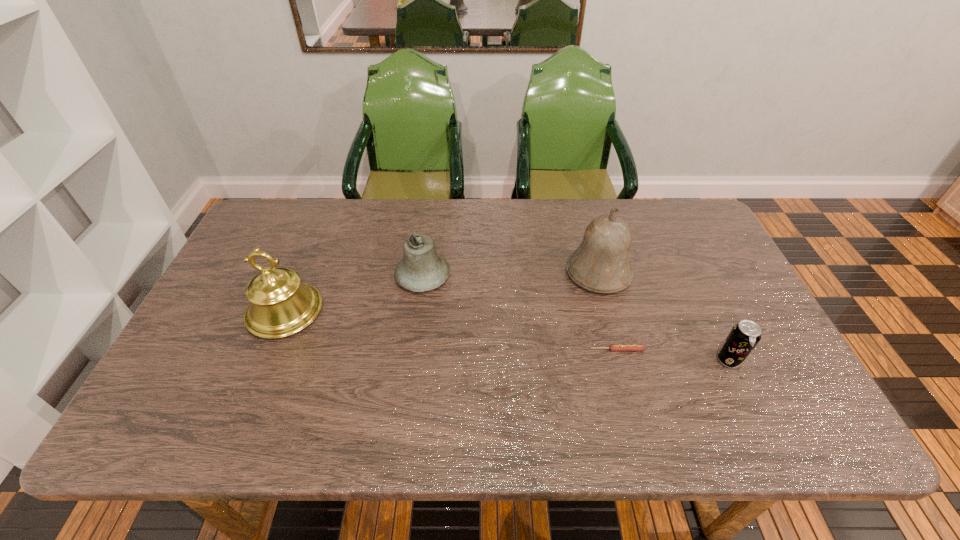
Image resolution: width=960 pixels, height=540 pixels. Identify the location of the rightmost bell. (601, 264).

This screenshot has width=960, height=540. Find the location of `the leftmost object`. the leftmost object is located at coordinates (280, 305).

You are a GUI agent. You are given a task and a screenshot of the screen. Output one action in this format:
    pyautogui.click(x=<x>, y=<y>)
    Task: Click on the fourth object from right to left
    The width and height of the screenshot is (960, 540).
    Given the screenshot: What is the action you would take?
    pyautogui.click(x=421, y=269)

At what (x,y) coordinates should I click in order to perform the action: click on the shortest bell. Please return your answer as a coordinate pair (x, y). Looking at the image, I should click on [421, 269].

Identify the location of the rightmost object. (745, 335).

At what (x,y) coordinates should I click in order to perform the action: click on soda can. Please return your answer as a coordinate pair (x, y). This screenshot has width=960, height=540. Looking at the image, I should click on (745, 335).

This screenshot has width=960, height=540. Identify the location of the shortest object. (613, 347).

Image resolution: width=960 pixels, height=540 pixels. In order to click on vacant region located on the left of the rightmost bell in this screenshot , I will do `click(512, 273)`.

Locate an element on the screen. This screenshot has height=540, width=960. free location located 0.080m on the front of the leftmost bell is located at coordinates (262, 368).

This screenshot has height=540, width=960. Identify the location of vacant area situated 0.300m on the right of the second bell from left to right. (553, 276).